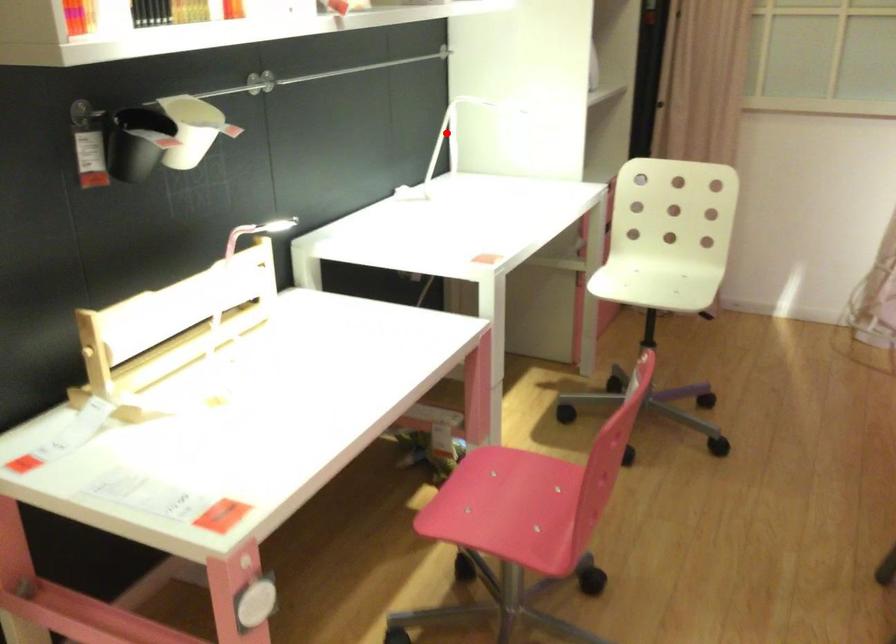
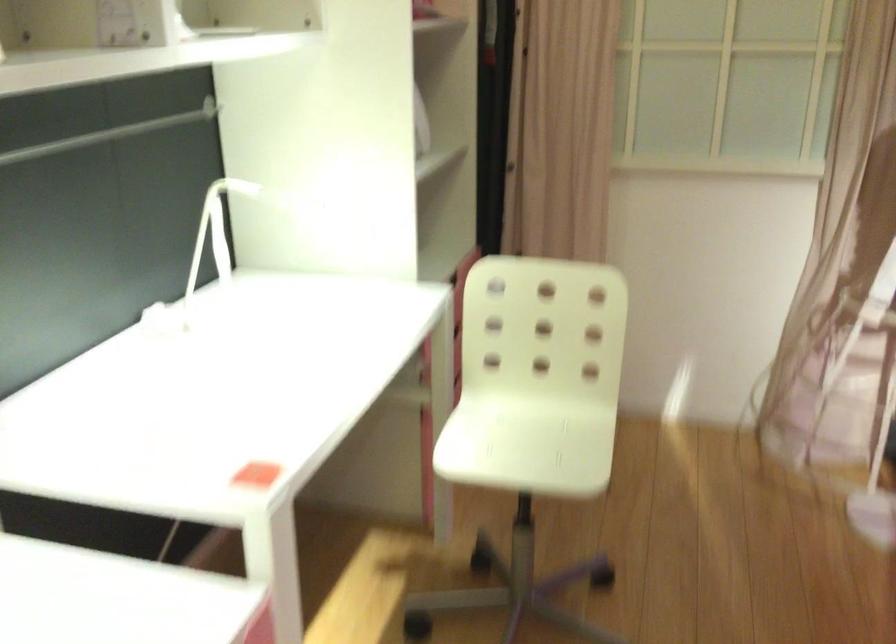
Where in the second image is the point corresponding to the highlighted location from the first image?

(213, 234)